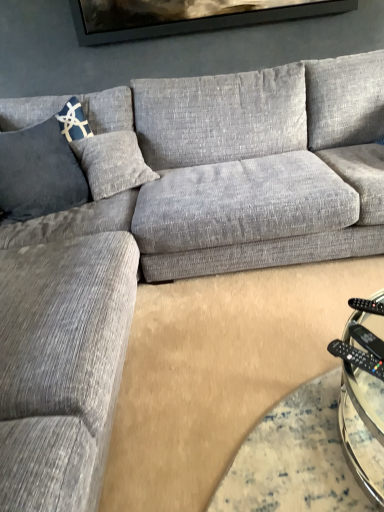
Question: Is black plastic remote at lower right, which is the first remote from bottom to top, thinner than black plastic remote at lower right, arranged as the first remote when viewed from the back?

Choices:
 (A) no
 (B) yes

Answer: (B)

Question: Can you confirm if black plastic remote at lower right, which is counted as the 2th remote, starting from the back, is smaller than black plastic remote at lower right, which ranks as the 2th remote in front-to-back order?

Choices:
 (A) yes
 (B) no

Answer: (A)

Question: Considering the relative sizes of black plastic remote at lower right, placed as the 2th remote when sorted from top to bottom, and black plastic remote at lower right, acting as the 1th remote starting from the top, in the image provided, is black plastic remote at lower right, placed as the 2th remote when sorted from top to bottom, bigger than black plastic remote at lower right, acting as the 1th remote starting from the top,?

Choices:
 (A) yes
 (B) no

Answer: (B)

Question: From the image's perspective, is black plastic remote at lower right, placed as the 2th remote when sorted from top to bottom, located above black plastic remote at lower right, which ranks as the 2th remote in front-to-back order?

Choices:
 (A) yes
 (B) no

Answer: (B)

Question: Does black plastic remote at lower right, placed as the 2th remote when sorted from top to bottom, touch black plastic remote at lower right, which ranks as the 2th remote in front-to-back order?

Choices:
 (A) no
 (B) yes

Answer: (B)

Question: Can you confirm if black plastic remote at lower right, which is counted as the 2th remote, starting from the back, is taller than black plastic remote at lower right, arranged as the first remote when viewed from the back?

Choices:
 (A) yes
 (B) no

Answer: (A)

Question: From a real-world perspective, is black plastic remote at lower right positioned under blue textured pillow at left based on gravity?

Choices:
 (A) no
 (B) yes

Answer: (B)

Question: Can blue textured pillow at left be found inside black plastic remote at lower right?

Choices:
 (A) no
 (B) yes

Answer: (A)

Question: Would you say black plastic remote at lower right is outside blue textured pillow at left?

Choices:
 (A) no
 (B) yes

Answer: (B)

Question: Is black plastic remote at lower right further to camera compared to blue textured pillow at left?

Choices:
 (A) no
 (B) yes

Answer: (A)

Question: From the image's perspective, is black plastic remote at lower right under blue textured pillow at left?

Choices:
 (A) no
 (B) yes

Answer: (B)

Question: Does black plastic remote at lower right have a greater height compared to blue textured pillow at left?

Choices:
 (A) yes
 (B) no

Answer: (B)

Question: Is black plastic remote at lower right outside black plastic remote at lower right, arranged as the first remote when viewed from the back?

Choices:
 (A) yes
 (B) no

Answer: (A)